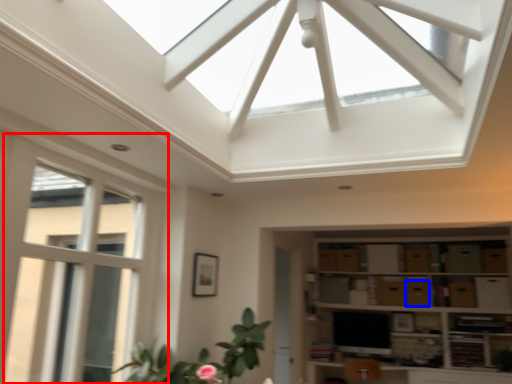
Question: Among these objects, which one is farthest to the camera, window (highlighted by a red box) or drawer (highlighted by a blue box)?

Choices:
 (A) window
 (B) drawer

Answer: (B)